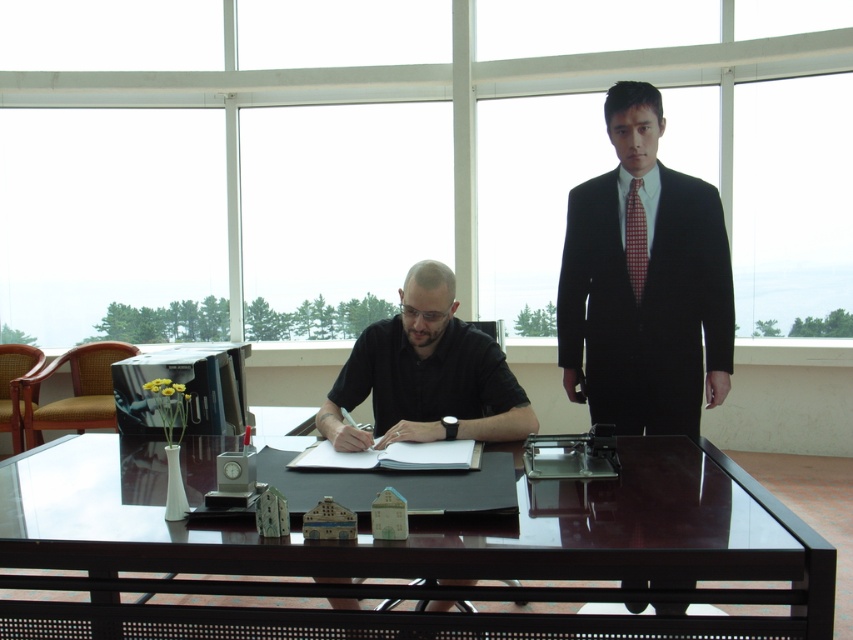
Who is positioned more to the left, black smooth shirt at center or red checkered tie at right?

From the viewer's perspective, black smooth shirt at center appears more on the left side.

Is point (506, 419) positioned in front of point (636, 259)?

Yes.

Is point (334, 420) closer to viewer compared to point (630, 202)?

Yes, point (334, 420) is in front of point (630, 202).

Where is `black smooth shirt at center`? black smooth shirt at center is located at coordinates (426, 374).

Between glossy dark wood table at center and black smooth shirt at center, which one is positioned higher?

black smooth shirt at center

In the scene shown: Is glossy dark wood table at center further to camera compared to black smooth shirt at center?

That is False.

Which is in front, point (16, 461) or point (416, 436)?

Point (416, 436)

What are the coordinates of `glossy dark wood table at center` in the screenshot? It's located at (413, 550).

Does glossy dark wood table at center have a greater height compared to red checkered tie at right?

Incorrect, glossy dark wood table at center's height is not larger of red checkered tie at right's.

Who is positioned more to the right, glossy dark wood table at center or red checkered tie at right?

red checkered tie at right

Measure the distance between point (73, 451) and camera.

Point (73, 451) is 7.12 feet away from camera.

Identify the location of glossy dark wood table at center. (413, 550).